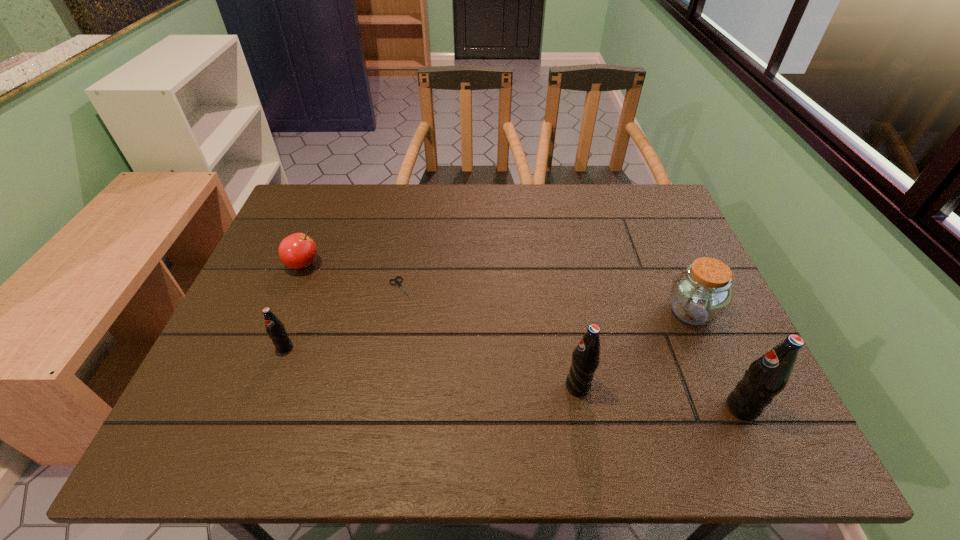
To make them evenly spaced by inserting another pop_(soda) among them, please locate a vacant spot for this new pop_(soda). Please provide its 2D coordinates. Your answer should be formatted as a tuple, i.e. [(x, y)], where the tuple contains the x and y coordinates of a point satisfying the conditions above.

[(426, 366)]